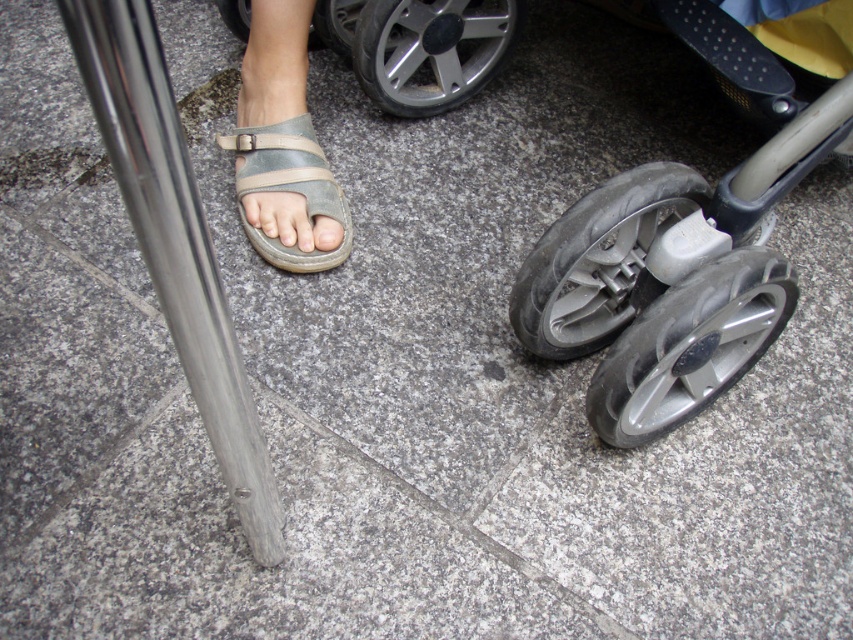
You are standing at the center of the paved surface and see the point marked at coordinates (175, 243). What object is located at that point?

The point at coordinates (175, 243) corresponds to the polished metal pole at left.

You are standing on the sidewalk and see the polished metal pole at left and the matte gray toe at center. Which object is nearer to you?

The polished metal pole at left is closer to the viewer than the matte gray toe at center.

Consider the image. You are standing at the center of the paved surface and want to walk towards the stroller with large black wheels. Which direction should you move relative to the polished metal pole at left?

Since the polished metal pole at left is located at point (175, 243), you should move towards the right side of the image away from the polished metal pole at left to reach the stroller with large black wheels.